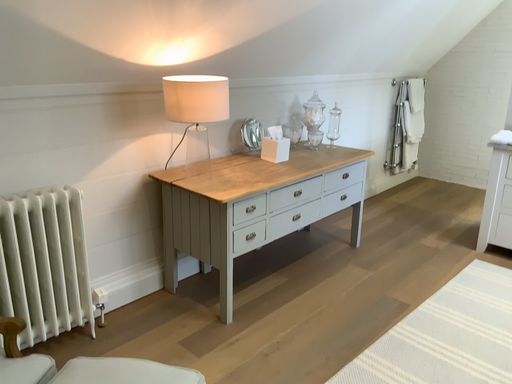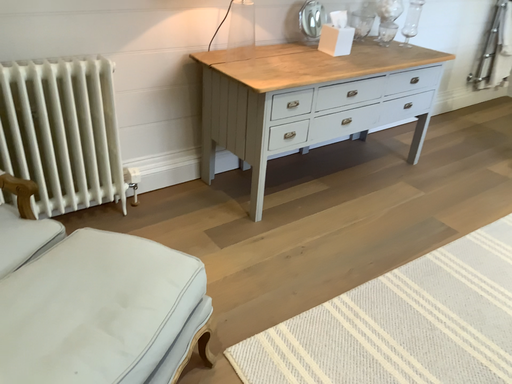
Question: Which way did the camera rotate in the video?

Choices:
 (A) rotated upward
 (B) rotated downward

Answer: (B)